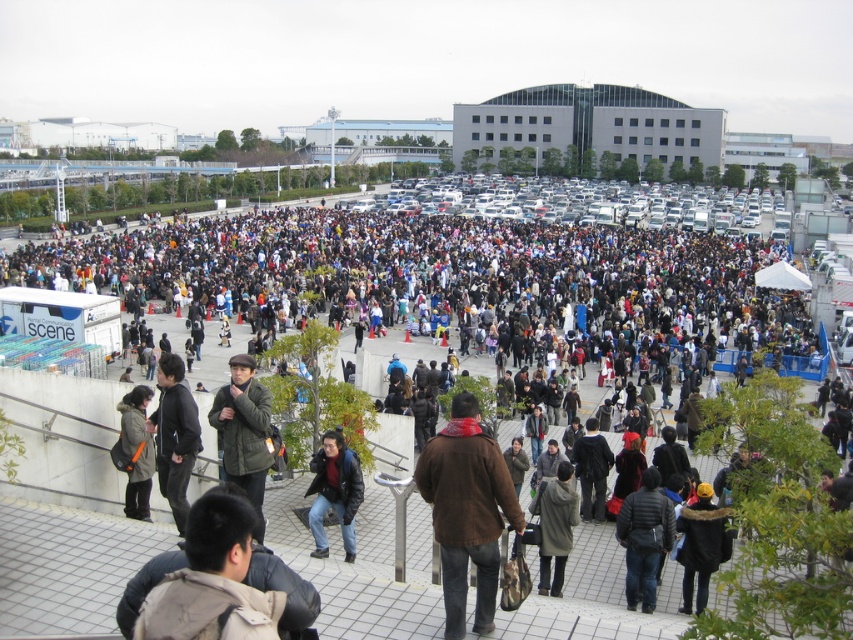
Is point (140, 624) farther from viewer compared to point (135, 412)?

No.

Which is below, dark brown jacket at lower left or orange fabric bag at lower left?

dark brown jacket at lower left is lower down.

What are the coordinates of `dark brown jacket at lower left` in the screenshot? It's located at (219, 580).

Identify the location of black fur-trimmed coat at lower right. (701, 545).

How much distance is there between black fur-trimmed coat at lower right and dark green jacket at center?

The distance of black fur-trimmed coat at lower right from dark green jacket at center is 15.47 feet.

Describe the element at coordinates (701, 545) in the screenshot. I see `black fur-trimmed coat at lower right` at that location.

The image size is (853, 640). What are the coordinates of `black fur-trimmed coat at lower right` in the screenshot? It's located at (701, 545).

Is brown leather jacket at center below orange fabric bag at lower left?

No.

Does brown leather jacket at center have a greater height compared to orange fabric bag at lower left?

Incorrect, brown leather jacket at center's height is not larger of orange fabric bag at lower left's.

Does point (448, 536) come behind point (149, 468)?

No, it is in front of (149, 468).

What are the coordinates of `brown leather jacket at center` in the screenshot? It's located at (466, 512).